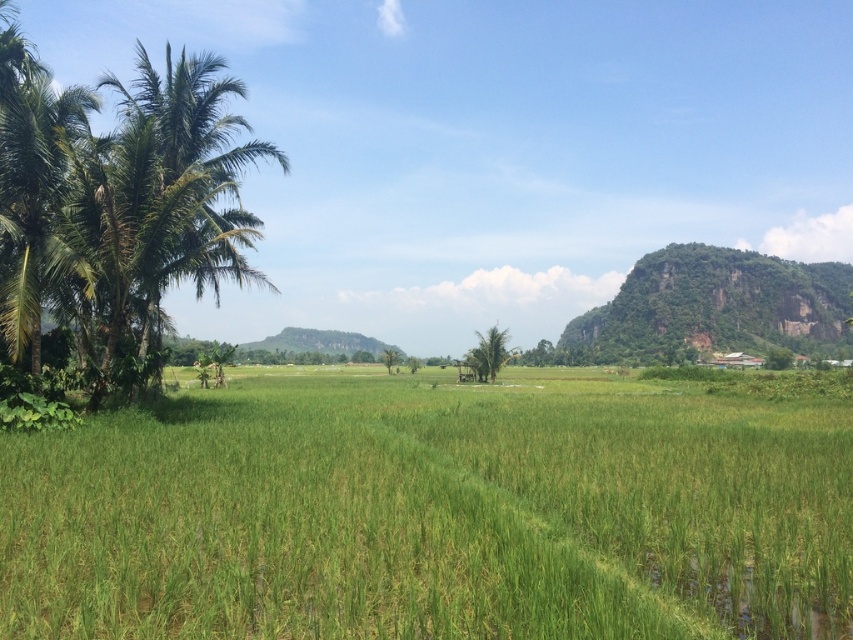
Who is more distant from viewer, (154, 205) or (709, 248)?

The point (709, 248) is behind.

Measure the distance between green leafy coconut tree at left and camera.

green leafy coconut tree at left and camera are 19.55 meters apart from each other.

Locate an element on the screen. green leafy coconut tree at left is located at coordinates (117, 205).

Locate an element on the screen. green grassy rice field at center is located at coordinates (437, 509).

Which is above, green grassy rice field at center or green leafy coconut tree at left?

green leafy coconut tree at left

Is point (498, 472) positioned after point (48, 209)?

No, it is in front of (48, 209).

Where is `green grassy rice field at center`? green grassy rice field at center is located at coordinates [437, 509].

Does green rocky mountain at right come in front of green leafy palm tree at center?

No.

Is point (651, 355) positioned in front of point (486, 365)?

No, it is behind (486, 365).

Locate an element on the screen. green rocky mountain at right is located at coordinates (715, 307).